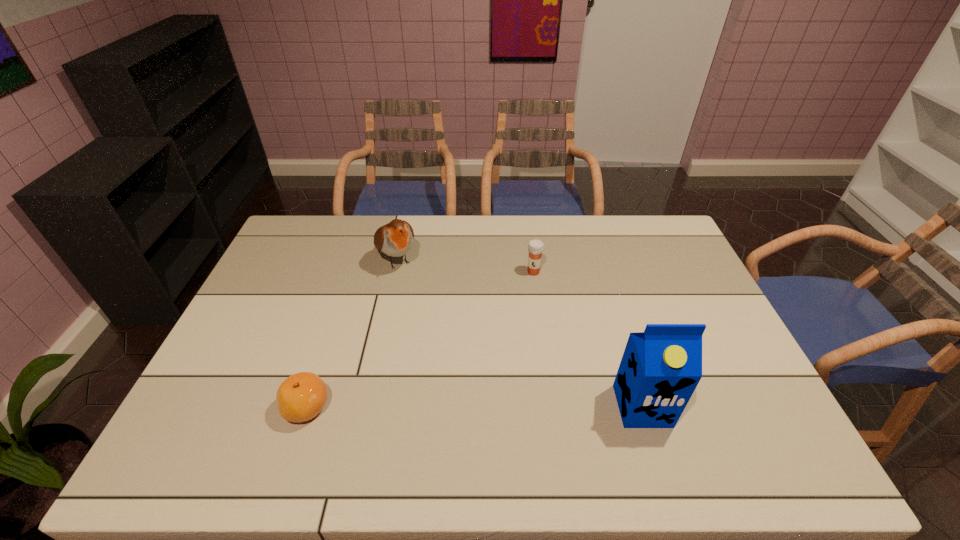
Identify the location of free space located 0.160m on the label side of the second object from right to left. Image resolution: width=960 pixels, height=540 pixels. (517, 309).

Where is `blank area located 0.380m on the label side of the second object from right to left`? The image size is (960, 540). blank area located 0.380m on the label side of the second object from right to left is located at coordinates (494, 363).

Identify the location of vacant space located at the face of the bird. Image resolution: width=960 pixels, height=540 pixels. (412, 292).

This screenshot has width=960, height=540. Identify the location of free point located at the face of the bird. (454, 360).

Where is `vacant space located at the face of the bird`? The height and width of the screenshot is (540, 960). vacant space located at the face of the bird is located at coordinates (424, 312).

Image resolution: width=960 pixels, height=540 pixels. I want to click on object located in the far edge section of the desktop, so pos(395,239).

This screenshot has height=540, width=960. Find the location of `clementine present at the near edge`. clementine present at the near edge is located at coordinates (300, 397).

The width and height of the screenshot is (960, 540). In order to click on carton that is positioned at the near edge in this screenshot , I will do `click(661, 367)`.

Where is `free region at the far edge of the desktop`? The image size is (960, 540). free region at the far edge of the desktop is located at coordinates (633, 253).

In order to click on vacant space at the near edge of the desktop in this screenshot , I will do `click(606, 402)`.